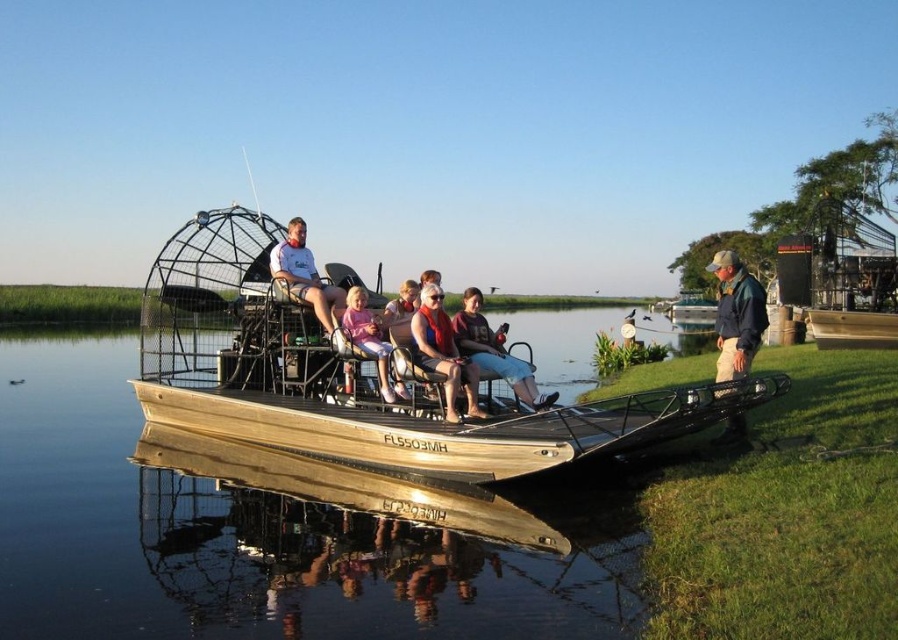
Question: Can you confirm if wooden airboat at center is positioned to the left of matte pink shirt at center?

Choices:
 (A) yes
 (B) no

Answer: (B)

Question: Which object is closer to the camera taking this photo?

Choices:
 (A) pink fabric baby carriage at center
 (B) matte orange life vest at center
 (C) green fabric jacket at right
 (D) wooden airboat at center

Answer: (D)

Question: Observing the image, what is the correct spatial positioning of green fabric jacket at right in reference to matte black shirt at center?

Choices:
 (A) left
 (B) right

Answer: (B)

Question: Among these points, which one is farthest from the camera?

Choices:
 (A) (403, 397)
 (B) (339, 596)

Answer: (A)

Question: Which of the following is the closest to the observer?

Choices:
 (A) matte pink shirt at center
 (B) smooth brown water at center
 (C) wooden airboat at center
 (D) green fabric jacket at right

Answer: (B)

Question: Does smooth brown water at center appear on the left side of pink fabric baby carriage at center?

Choices:
 (A) yes
 (B) no

Answer: (A)